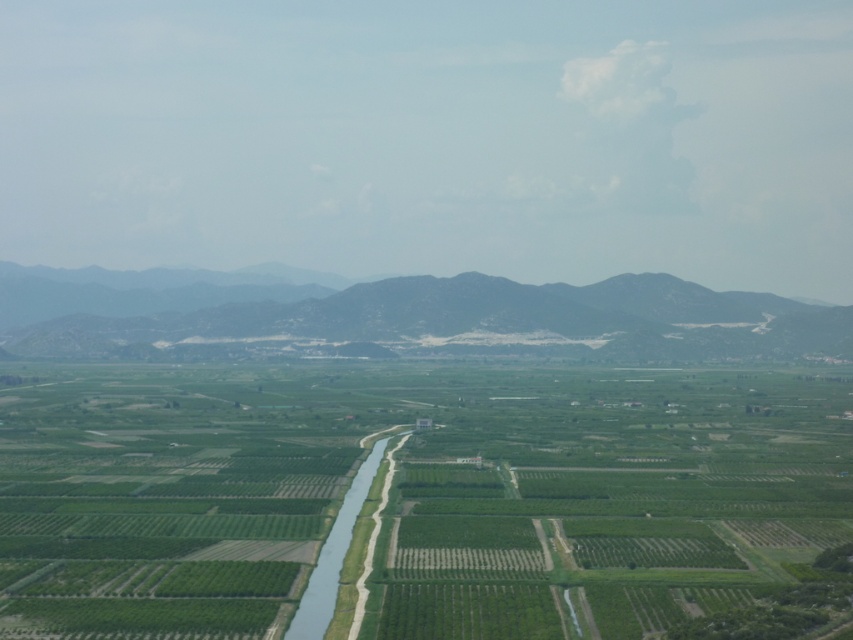
Question: Does green textured mountain at center appear over green grassy waterway at center?

Choices:
 (A) yes
 (B) no

Answer: (A)

Question: Is the position of green grassy fields at center more distant than that of green textured mountain at center?

Choices:
 (A) yes
 (B) no

Answer: (B)

Question: Can you confirm if green grassy fields at center is smaller than green textured mountain at center?

Choices:
 (A) yes
 (B) no

Answer: (A)

Question: Among these objects, which one is nearest to the camera?

Choices:
 (A) green textured mountain at center
 (B) green grassy waterway at center
 (C) green grassy fields at center

Answer: (C)

Question: Which object is positioned farthest from the green grassy waterway at center?

Choices:
 (A) green grassy fields at center
 (B) green textured mountain at center

Answer: (B)

Question: Which object is farther from the camera taking this photo?

Choices:
 (A) green grassy waterway at center
 (B) green textured mountain at center
 (C) green grassy fields at center

Answer: (B)